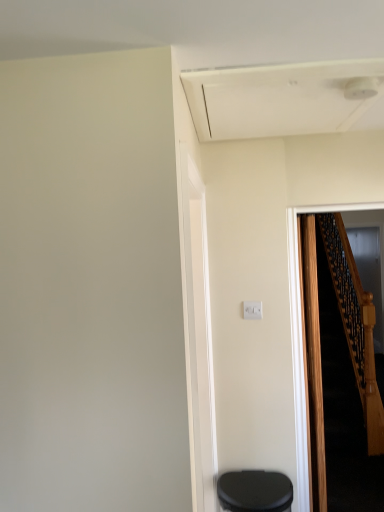
Question: Considering the positions of point (243, 494) and point (256, 302), is point (243, 494) closer or farther from the camera than point (256, 302)?

Choices:
 (A) closer
 (B) farther

Answer: (A)

Question: In terms of size, does black matte trash can at lower right appear bigger or smaller than white plastic electric outlet at center?

Choices:
 (A) big
 (B) small

Answer: (A)

Question: Which object is the closest to the black matte trash can at lower right?

Choices:
 (A) transparent glass door at right
 (B) white plastic electric outlet at center
 (C) wooden at right

Answer: (B)

Question: Estimate the real-world distances between objects in this image. Which object is closer to the black matte trash can at lower right?

Choices:
 (A) white plastic electric outlet at center
 (B) wooden at right
 (C) transparent glass door at right

Answer: (A)